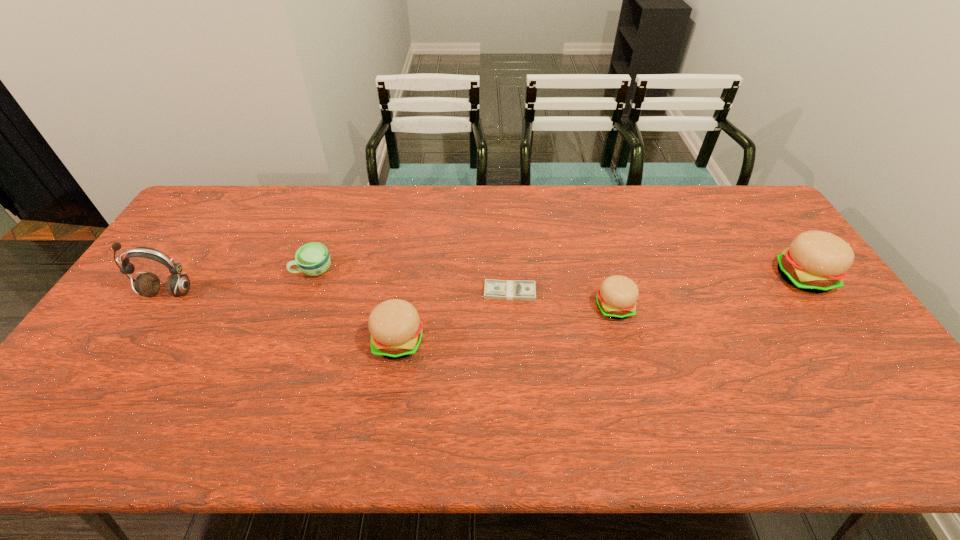
In the image, there is a desktop. Identify the location of vacant area at the far edge. (384, 187).

The width and height of the screenshot is (960, 540). In the image, there is a desktop. Find the location of `vacant area at the near edge`. vacant area at the near edge is located at coordinates (487, 393).

In the image, there is a desktop. What are the coordinates of `vacant space at the right edge` in the screenshot? It's located at (840, 322).

Where is `vacant point at the far right corner`? This screenshot has width=960, height=540. vacant point at the far right corner is located at coordinates (735, 198).

In the image, there is a desktop. Where is `free region at the near right corner`? Image resolution: width=960 pixels, height=540 pixels. free region at the near right corner is located at coordinates (898, 393).

Find the location of a particular element. free spot between the cup and the earphone is located at coordinates (241, 281).

Identify the location of vacant region between the tallest hamburger and the shortest object. (656, 285).

Find the location of `free space between the shortest hamburger and the cup`. free space between the shortest hamburger and the cup is located at coordinates (464, 289).

Find the location of `empty space that is in between the third tallest object and the fifth object from left to right`. empty space that is in between the third tallest object and the fifth object from left to right is located at coordinates (506, 325).

The height and width of the screenshot is (540, 960). Identify the location of free space between the dollar and the tallest hamburger. (656, 285).